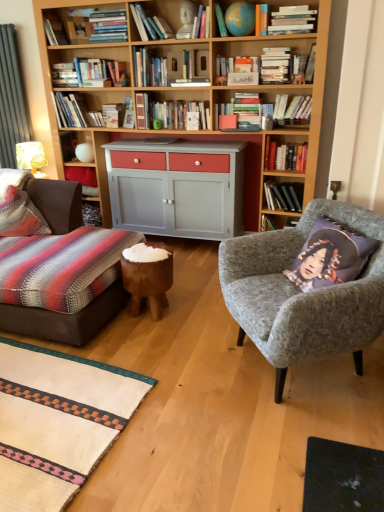
Question: From the image's perspective, is hardcover book at upper center, the 7th book from the left, positioned above or below hardcover books at upper right, the 13th book from the left?

Choices:
 (A) below
 (B) above

Answer: (B)

Question: Would you say hardcover book at upper center, the 7th book from the left, is inside or outside hardcover books at upper right, the 13th book from the left?

Choices:
 (A) inside
 (B) outside

Answer: (B)

Question: Which object is the closest to the hardcover books at upper center, which ranks as the 11th book in left-to-right order?

Choices:
 (A) hardcover book at upper center, placed as the eleventh book when sorted from right to left
 (B) hardcover book at upper center, positioned as the 15th book in left-to-right order
 (C) hardcover book at upper left, arranged as the fourteenth book when viewed from the right
 (D) striped fabric pillow at left
 (E) hardcover books at upper right, the 13th book from the left

Answer: (B)

Question: Estimate the real-world distances between objects in this image. Which object is closer to the hardcover book at upper left, which is the second book from left to right?

Choices:
 (A) striped fabric pillow at left
 (B) hardcover books at upper center, the 6th book from the right
 (C) hardcover book at upper center, acting as the 12th book starting from the right
 (D) hardcover book at upper center, marked as the 1th book in a right-to-left arrangement
 (E) white matte book at upper center, arranged as the 4th book when viewed from the right

Answer: (C)